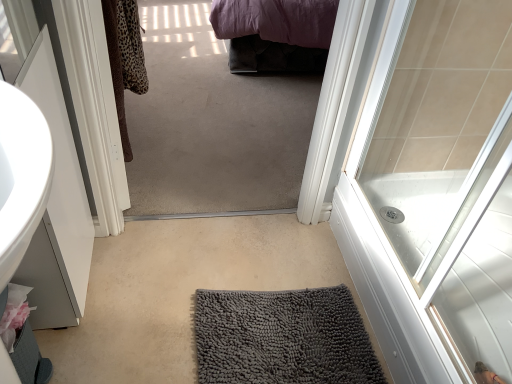
Question: Is gray chenille bath mat at center far away from white glossy door at upper right?

Choices:
 (A) yes
 (B) no

Answer: (B)

Question: From a real-world perspective, is gray chenille bath mat at center positioned over white glossy door at upper right based on gravity?

Choices:
 (A) yes
 (B) no

Answer: (B)

Question: Is gray chenille bath mat at center next to white glossy door at upper right?

Choices:
 (A) no
 (B) yes

Answer: (A)

Question: Is gray chenille bath mat at center taller than white glossy door at upper right?

Choices:
 (A) yes
 (B) no

Answer: (B)

Question: Does gray chenille bath mat at center have a lesser height compared to white glossy door at upper right?

Choices:
 (A) yes
 (B) no

Answer: (A)

Question: Can you confirm if gray chenille bath mat at center is bigger than white glossy door at upper right?

Choices:
 (A) no
 (B) yes

Answer: (A)

Question: Does gray textured bath mat at center have a larger size compared to white glossy door at upper right?

Choices:
 (A) yes
 (B) no

Answer: (B)

Question: Considering the relative sizes of gray textured bath mat at center and white glossy door at upper right in the image provided, is gray textured bath mat at center smaller than white glossy door at upper right?

Choices:
 (A) no
 (B) yes

Answer: (B)

Question: From a real-world perspective, is gray textured bath mat at center physically below white glossy door at upper right?

Choices:
 (A) yes
 (B) no

Answer: (A)

Question: Is gray textured bath mat at center placed right next to white glossy door at upper right?

Choices:
 (A) no
 (B) yes

Answer: (A)

Question: Can you confirm if gray textured bath mat at center is positioned to the right of white glossy door at upper right?

Choices:
 (A) yes
 (B) no

Answer: (B)

Question: Could white glossy door at upper right be considered to be inside gray textured bath mat at center?

Choices:
 (A) yes
 (B) no

Answer: (B)

Question: Considering the relative sizes of gray textured bath mat at center and gray chenille bath mat at center in the image provided, is gray textured bath mat at center shorter than gray chenille bath mat at center?

Choices:
 (A) yes
 (B) no

Answer: (A)